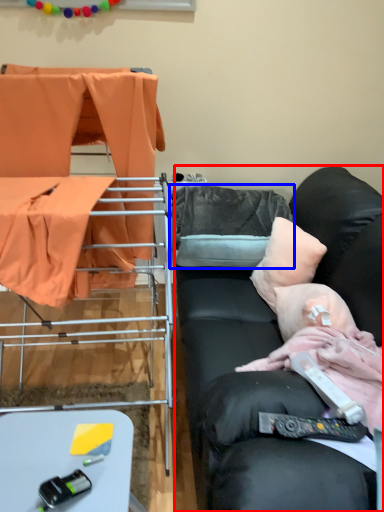
Question: Which of the following is the closest to the observer, studio couch (highlighted by a red box) or pillow (highlighted by a blue box)?

Choices:
 (A) studio couch
 (B) pillow

Answer: (A)